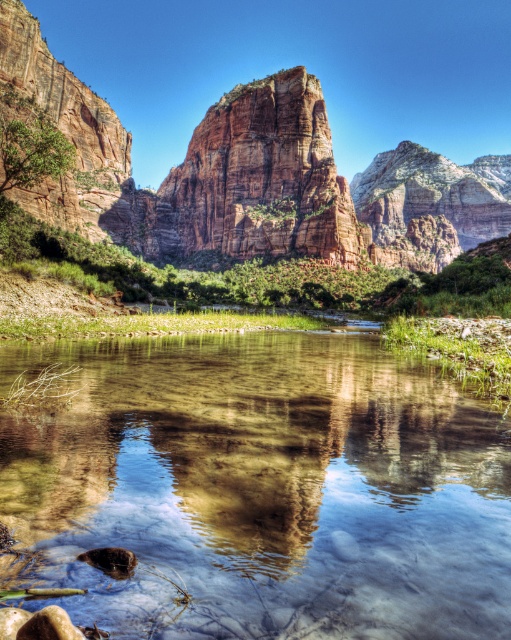
Question: Which of the following is the farthest from the observer?

Choices:
 (A) (324, 141)
 (B) (310, 193)
 (C) (74, 541)

Answer: (A)

Question: Which object is closer to the camera taking this photo?

Choices:
 (A) clear water at center
 (B) reddish-brown sandstone cliff at center

Answer: (A)

Question: Does clear water at center lie behind rustic sandstone mountain at center?

Choices:
 (A) no
 (B) yes

Answer: (A)

Question: Which of the following is the farthest from the observer?

Choices:
 (A) (249, 148)
 (B) (378, 419)
 (C) (361, 228)

Answer: (A)

Question: Is clear water at center wider than reddish-brown sandstone cliff at center?

Choices:
 (A) yes
 (B) no

Answer: (B)

Question: Can you confirm if clear water at center is bigger than rustic sandstone mountain at center?

Choices:
 (A) yes
 (B) no

Answer: (B)